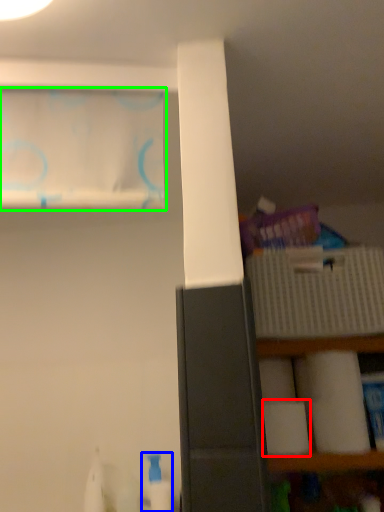
Question: Based on their relative distances, which object is farther from toilet paper (highlighted by a red box)? Choose from cleaning product (highlighted by a blue box) and curtain (highlighted by a green box).

Choices:
 (A) cleaning product
 (B) curtain

Answer: (B)